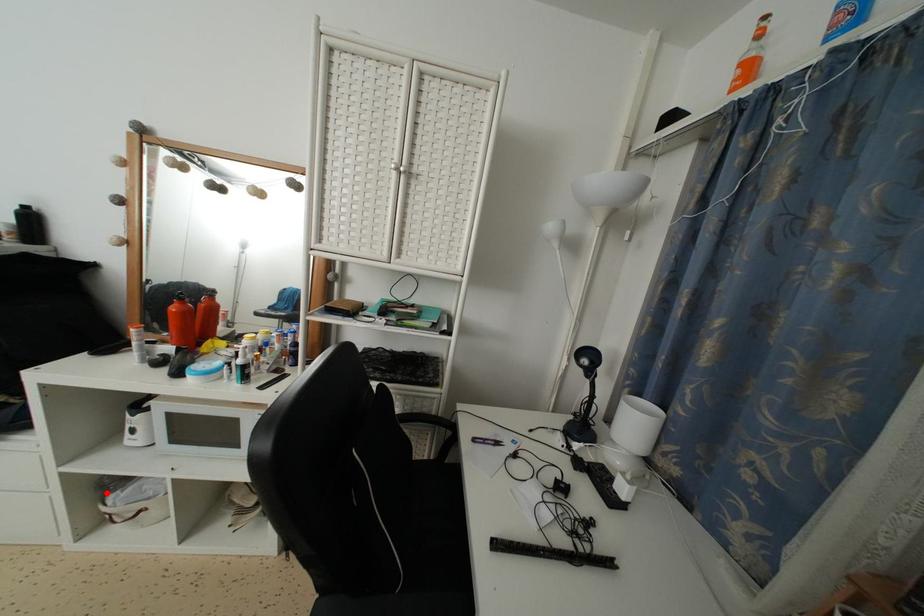
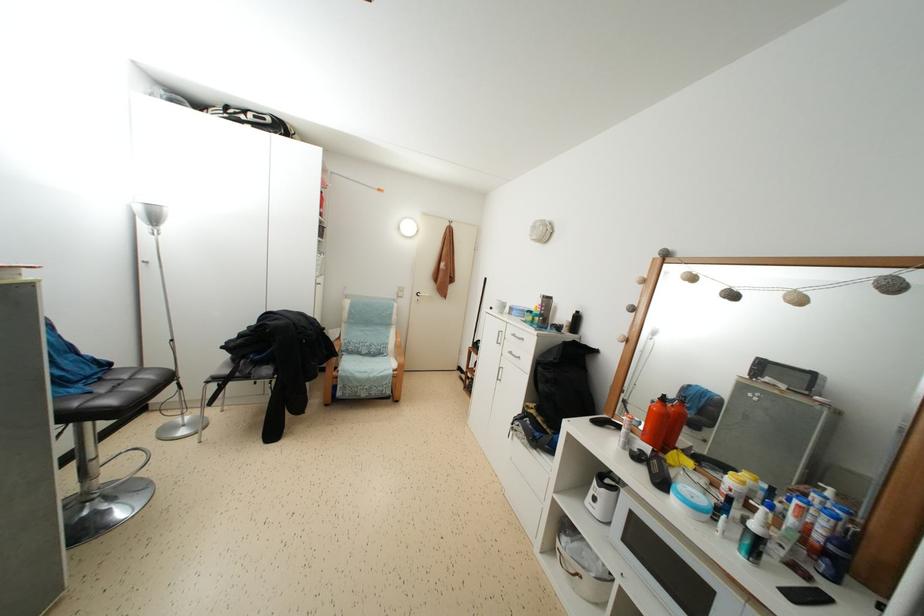
Question: I am providing you with two images of the same scene from different viewpoints. Image1 has a red point marked. In image2, the corresponding 3D location appears at what relative position? Reply with the corresponding letter.

Choices:
 (A) Closer
 (B) Farther

Answer: (B)